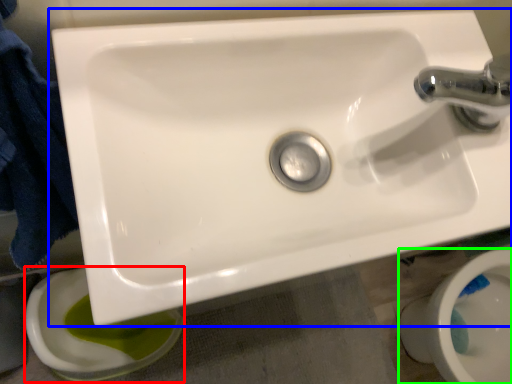
Question: Estimate the real-world distances between objects in this image. Which object is farther from toilet bowl (highlighted by a red box), sink (highlighted by a blue box) or toilet bowl (highlighted by a green box)?

Choices:
 (A) sink
 (B) toilet bowl

Answer: (B)